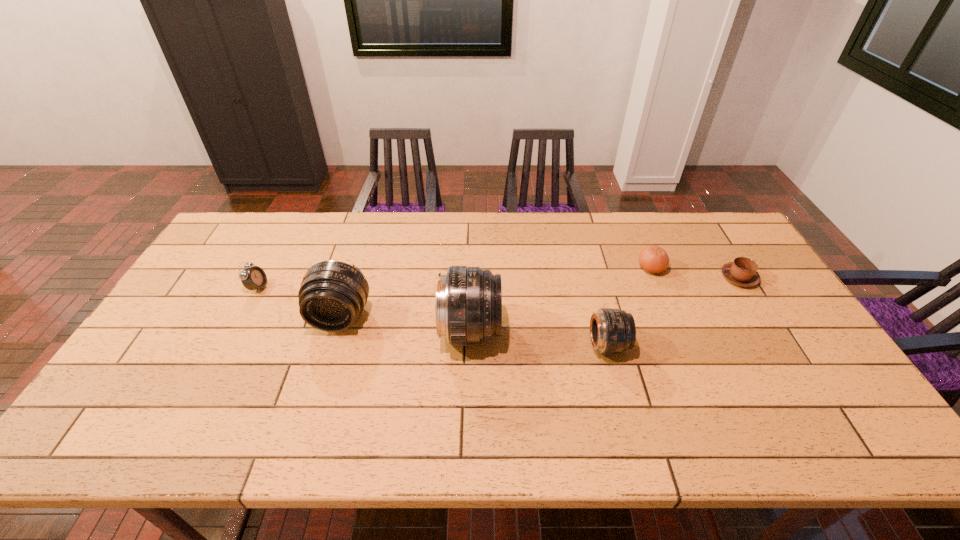
Where is `the second tallest telephoto lens`? the second tallest telephoto lens is located at coordinates (332, 295).

Identify the location of the second object from left to right. (332, 295).

Locate an element on the screen. the second telephoto lens from left to right is located at coordinates point(468,303).

This screenshot has width=960, height=540. I want to click on the fourth object from left to right, so click(x=612, y=331).

At what (x,y) coordinates should I click in order to perform the action: click on the shortest telephoto lens. Please return your answer as a coordinate pair (x, y). This screenshot has width=960, height=540. Looking at the image, I should click on (612, 331).

Identify the location of alarm clock. pyautogui.click(x=253, y=278).

Where is `the leftmost object`? The width and height of the screenshot is (960, 540). the leftmost object is located at coordinates (253, 278).

Identify the location of clementine. (653, 259).

Locate an element on the screen. The image size is (960, 540). the fifth tallest object is located at coordinates (653, 259).

Where is `the rightmost object`? The width and height of the screenshot is (960, 540). the rightmost object is located at coordinates (742, 271).